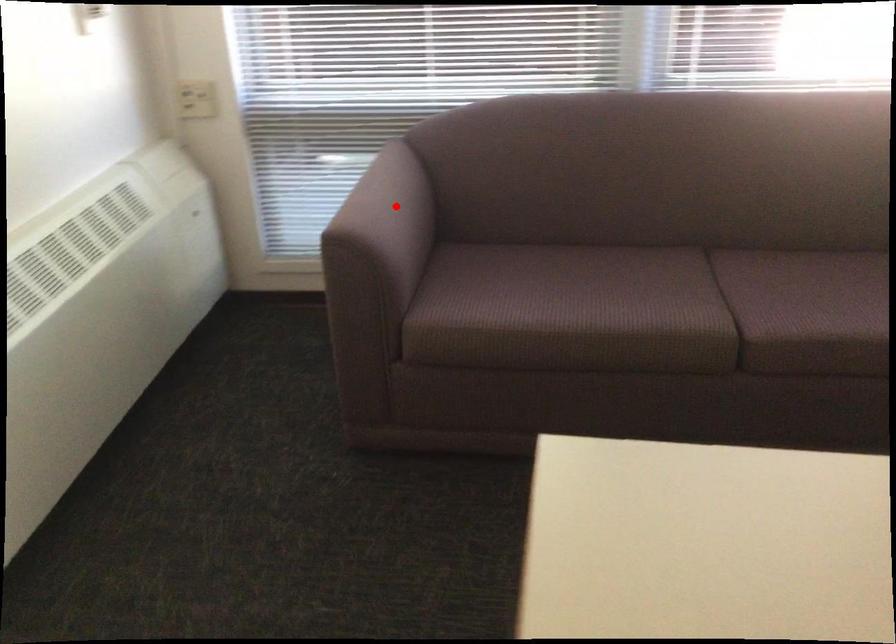
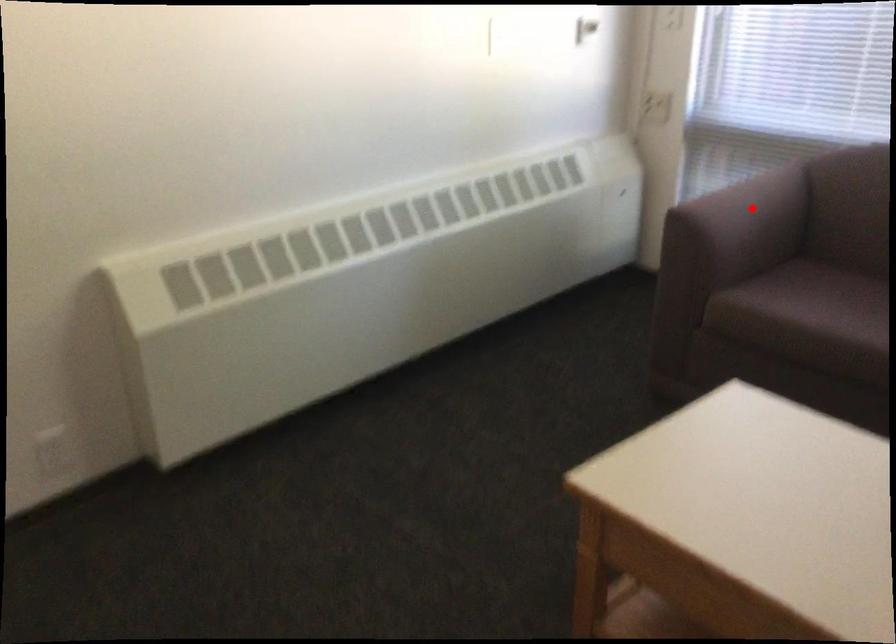
I am providing you with two images of the same scene from different viewpoints. A red point is marked on the first image and another point is marked on the second image. Does the point marked in image1 correspond to the same location as the one in image2?

Yes